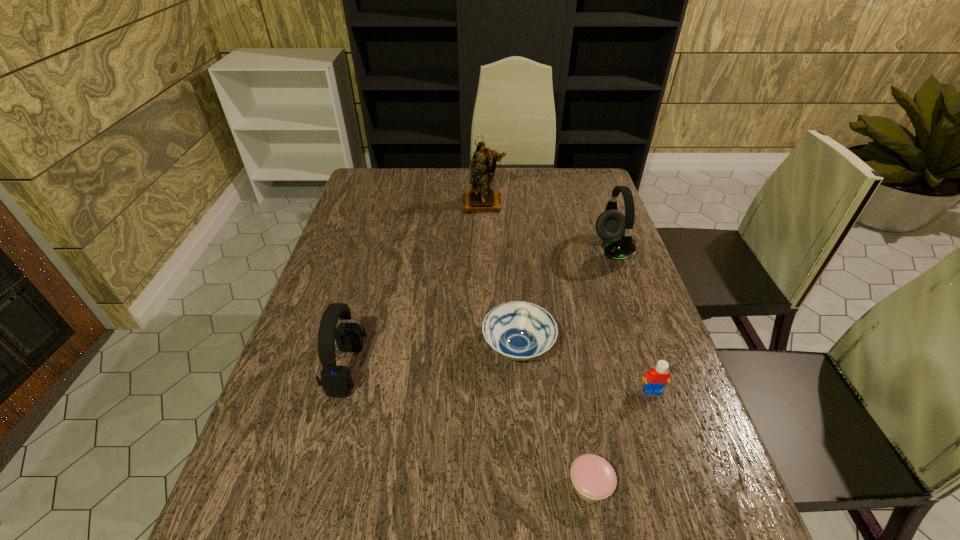
Where is `vacant point located between the nearer headset and the nearest object`? The width and height of the screenshot is (960, 540). vacant point located between the nearer headset and the nearest object is located at coordinates (468, 427).

Image resolution: width=960 pixels, height=540 pixels. Identify the location of unoccupied position between the third shortest object and the left headset. (499, 379).

Locate an element on the screen. This screenshot has height=540, width=960. empty location between the cupcake and the nearer headset is located at coordinates (468, 427).

Find the location of a particular element. This screenshot has width=960, height=540. vacant space in between the cupcake and the fourth tallest object is located at coordinates (621, 438).

In order to click on free area in between the fifth tallest object and the fourth tallest object in this screenshot , I will do tap(585, 370).

Where is `object that is the third closest to the fifth tallest object`? This screenshot has height=540, width=960. object that is the third closest to the fifth tallest object is located at coordinates (336, 381).

The width and height of the screenshot is (960, 540). What are the coordinates of `object that is the second closest to the farther headset` in the screenshot? It's located at (480, 198).

This screenshot has width=960, height=540. I want to click on vacant region that satisfies the following two spatial constraints: 1. on the ear cups of the second farthest object; 2. on the face of the third shortest object, so click(x=662, y=390).